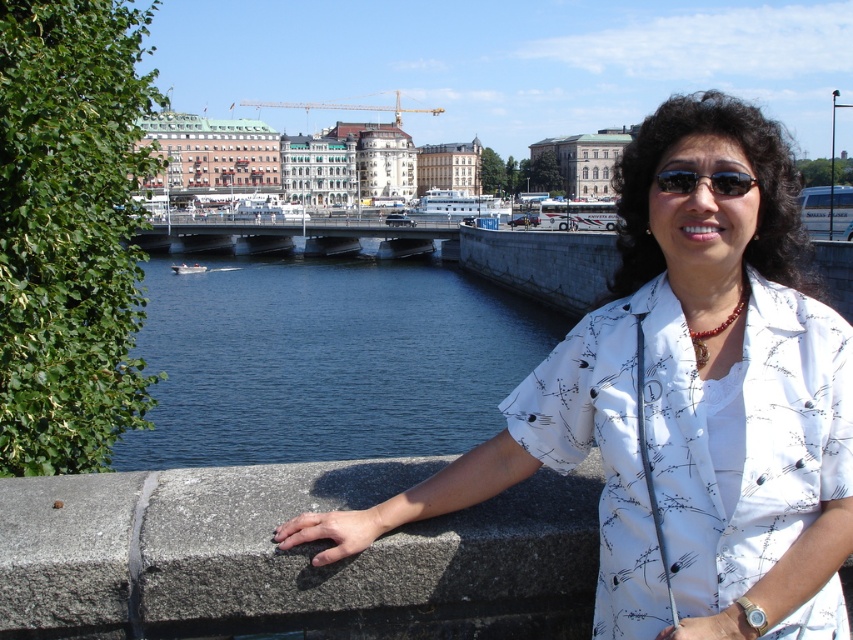
Question: From the image, what is the correct spatial relationship of white printed blouse at center in relation to concrete bridge at center?

Choices:
 (A) above
 (B) below

Answer: (B)

Question: Among these points, which one is farthest from the camera?

Choices:
 (A) (839, 488)
 (B) (384, 248)
 (C) (169, 330)

Answer: (B)

Question: Which point is farther to the camera?

Choices:
 (A) white printed blouse at center
 (B) black reflective sunglasses at center
 (C) concrete bridge at center
 (D) blue water at center

Answer: (C)

Question: Which object is closer to the camera taking this photo?

Choices:
 (A) white printed blouse at center
 (B) concrete bridge at center

Answer: (A)

Question: Does white printed blouse at center come behind black reflective sunglasses at center?

Choices:
 (A) no
 (B) yes

Answer: (A)

Question: Is blue water at center above concrete bridge at center?

Choices:
 (A) yes
 (B) no

Answer: (B)